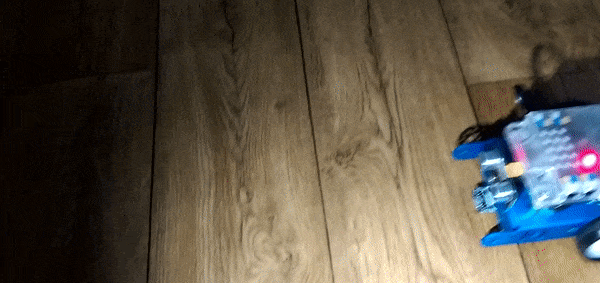
You are a GUI agent. You are given a task and a screenshot of the screen. Output one action in this format:
    pyautogui.click(x=<x>, y=<y>)
    Task: Click on the floor
    
    Given the screenshot: What is the action you would take?
    pyautogui.click(x=380, y=147)